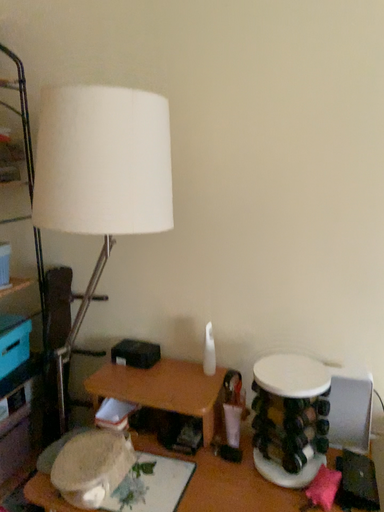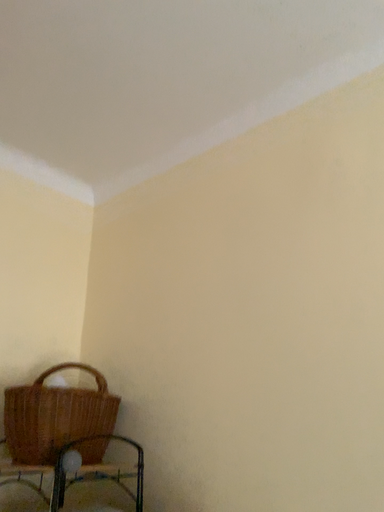
Question: Which way did the camera rotate in the video?

Choices:
 (A) rotated right
 (B) rotated left

Answer: (B)